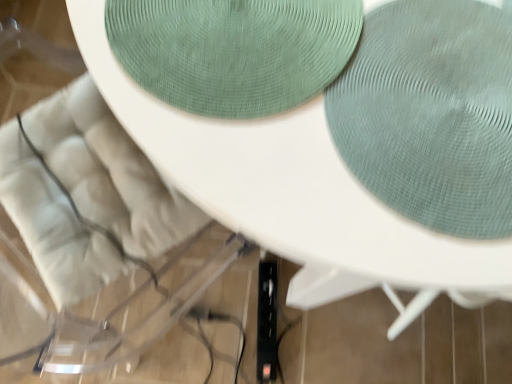
Where is `vacant space underneath green textured placemat at upper center (from a real-world perspective)`? vacant space underneath green textured placemat at upper center (from a real-world perspective) is located at coordinates (271, 35).